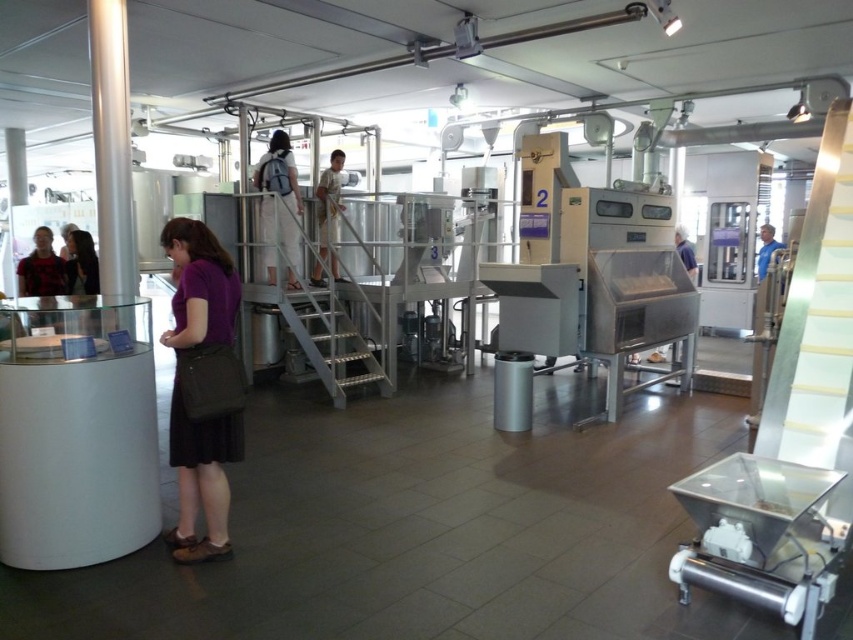
Question: Can you confirm if light beige fabric backpack at center is positioned to the left of white fabric dress at center?

Choices:
 (A) yes
 (B) no

Answer: (A)

Question: Which is farther from the blue shirt at right?

Choices:
 (A) light beige fabric backpack at center
 (B) matte black shirt at left
 (C) white fabric dress at center

Answer: (B)

Question: Which object is farther from the camera taking this photo?

Choices:
 (A) matte black shirt at left
 (B) blue shirt at right
 (C) purple fabric dress at lower left

Answer: (B)

Question: Is purple fabric dress at lower left thinner than white fabric dress at center?

Choices:
 (A) yes
 (B) no

Answer: (B)

Question: Is purple fabric dress at lower left positioned in front of matte black shirt at left?

Choices:
 (A) yes
 (B) no

Answer: (A)

Question: Among these objects, which one is farthest from the camera?

Choices:
 (A) purple fabric dress at lower left
 (B) matte black shirt at left
 (C) light beige fabric backpack at center
 (D) blue shirt at right

Answer: (D)